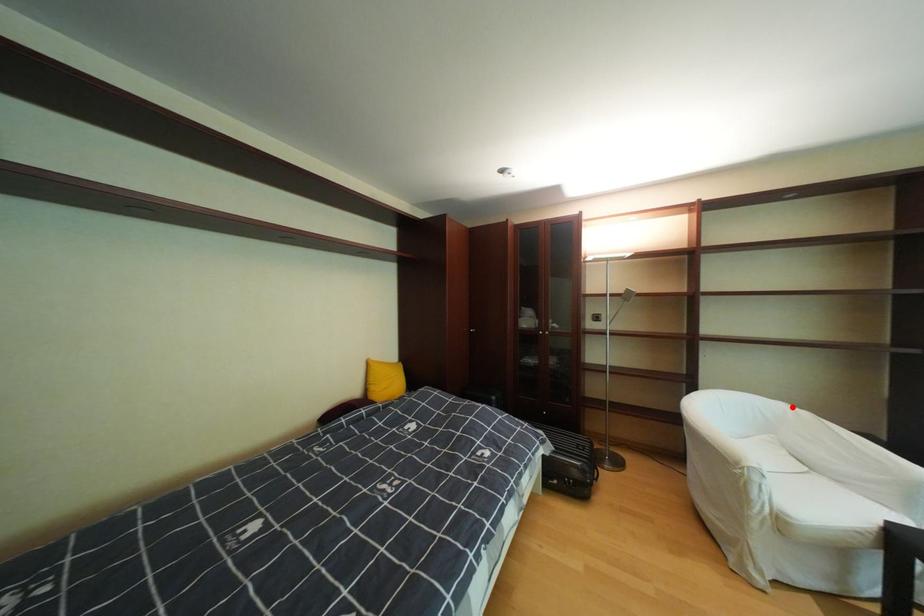
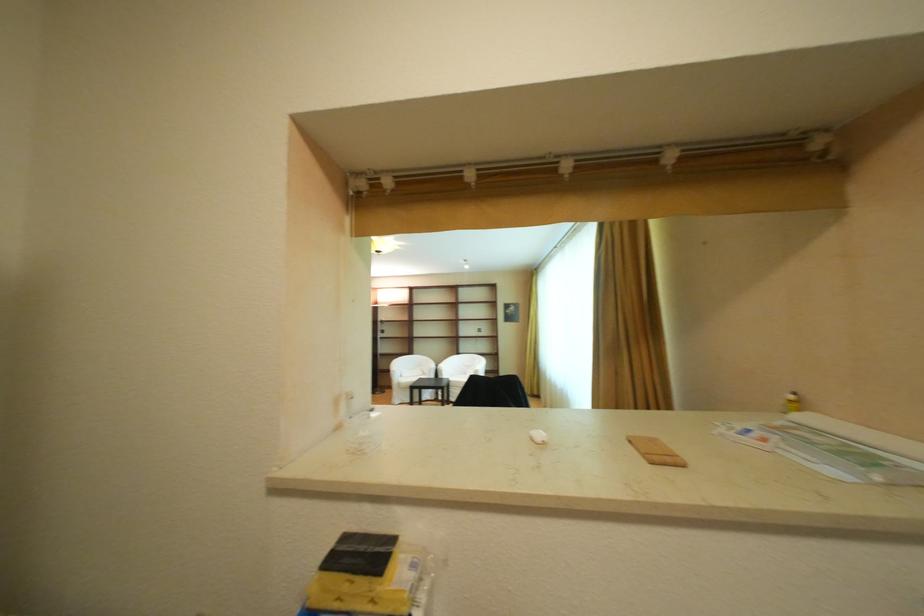
Question: I am providing you with two images of the same scene from different viewpoints. In image1, a red point is highlighted. Considering the same 3D point in image2, which of the following is correct?

Choices:
 (A) It is closer
 (B) It is farther

Answer: (B)